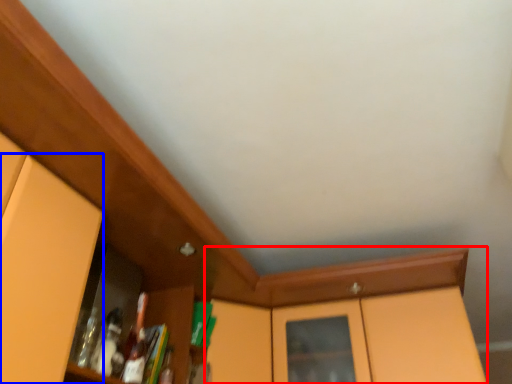
Question: Which object appears closest to the camera in this image, cabinetry (highlighted by a red box) or door (highlighted by a blue box)?

Choices:
 (A) cabinetry
 (B) door

Answer: (B)